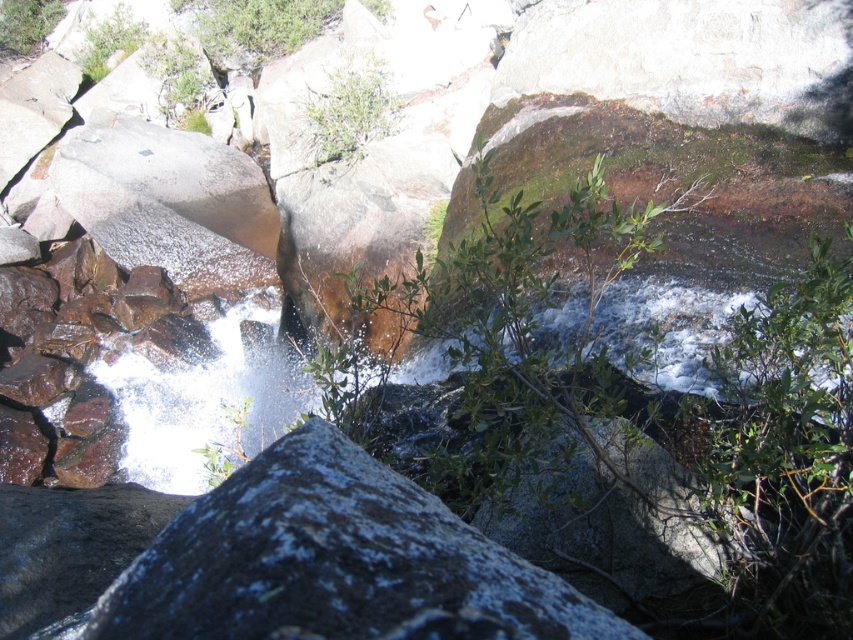
Question: Does gray/rough rock at center have a greater width compared to green leafy bush at upper left?

Choices:
 (A) yes
 (B) no

Answer: (B)

Question: Does gray/rough rock at center have a lesser width compared to green leafy bush at center?

Choices:
 (A) no
 (B) yes

Answer: (B)

Question: Which point is farther from the camera taking this photo?

Choices:
 (A) (15, 36)
 (B) (334, 68)

Answer: (A)

Question: Which point is farther to the camera?

Choices:
 (A) (305, 596)
 (B) (329, 97)

Answer: (B)

Question: Based on their relative distances, which object is nearer to the green leafy bush at upper left?

Choices:
 (A) gray/rough rock at center
 (B) green leafy bush at center

Answer: (B)

Question: Is green leafy bush at center positioned behind green leafy bush at upper left?

Choices:
 (A) yes
 (B) no

Answer: (B)